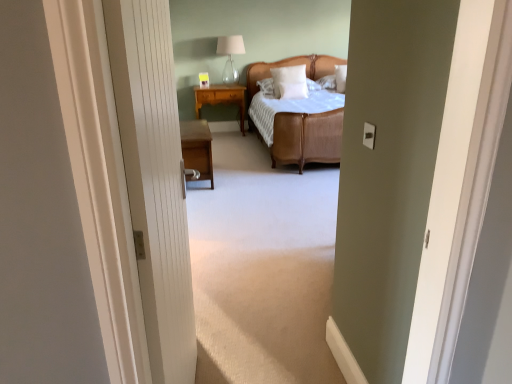
Question: Considering the relative sizes of light brown wood nightstand at center, the 1th nightstand when ordered from top to bottom, and white soft pillow at center, placed as the first pillow when sorted from top to bottom, in the image provided, is light brown wood nightstand at center, the 1th nightstand when ordered from top to bottom, taller than white soft pillow at center, placed as the first pillow when sorted from top to bottom,?

Choices:
 (A) yes
 (B) no

Answer: (A)

Question: Is light brown wood nightstand at center, which is counted as the second nightstand, starting from the bottom, placed right next to white soft pillow at center, which is counted as the second pillow, starting from the bottom?

Choices:
 (A) no
 (B) yes

Answer: (A)

Question: Is light brown wood nightstand at center, which is counted as the second nightstand, starting from the bottom, turned away from white soft pillow at center, which is counted as the second pillow, starting from the bottom?

Choices:
 (A) no
 (B) yes

Answer: (A)

Question: Is light brown wood nightstand at center, the first nightstand when ordered from back to front, oriented towards white soft pillow at center, which is counted as the second pillow, starting from the bottom?

Choices:
 (A) no
 (B) yes

Answer: (A)

Question: Can you confirm if light brown wood nightstand at center, which is counted as the second nightstand, starting from the bottom, is wider than white soft pillow at center, placed as the first pillow when sorted from top to bottom?

Choices:
 (A) no
 (B) yes

Answer: (B)

Question: From a real-world perspective, is woven rattan bed at center above or below white soft pillow at center, placed as the first pillow when sorted from top to bottom?

Choices:
 (A) below
 (B) above

Answer: (A)

Question: From the image's perspective, is woven rattan bed at center positioned above or below white soft pillow at center, placed as the first pillow when sorted from top to bottom?

Choices:
 (A) above
 (B) below

Answer: (B)

Question: Does point (278, 155) appear closer or farther from the camera than point (298, 91)?

Choices:
 (A) closer
 (B) farther

Answer: (A)

Question: Is woven rattan bed at center inside or outside of white soft pillow at center, which is counted as the second pillow, starting from the bottom?

Choices:
 (A) inside
 (B) outside

Answer: (B)

Question: Is point pos(274,72) closer or farther from the camera than point pos(161,135)?

Choices:
 (A) farther
 (B) closer

Answer: (A)

Question: Is white soft pillow at center, which is counted as the second pillow, starting from the bottom, inside or outside of white textured door at center?

Choices:
 (A) inside
 (B) outside

Answer: (B)

Question: In the image, is white soft pillow at center, placed as the first pillow when sorted from top to bottom, on the left side or the right side of white textured door at center?

Choices:
 (A) right
 (B) left

Answer: (A)

Question: From a real-world perspective, is white soft pillow at center, placed as the first pillow when sorted from top to bottom, physically located above or below white textured door at center?

Choices:
 (A) below
 (B) above

Answer: (B)

Question: From the image's perspective, relative to white soft pillow at center, placed as the first pillow when sorted from top to bottom, is wooden nightstand at left, which appears as the second nightstand when viewed from the back, above or below?

Choices:
 (A) above
 (B) below

Answer: (B)

Question: Considering the positions of wooden nightstand at left, which is counted as the first nightstand, starting from the bottom, and white soft pillow at center, placed as the first pillow when sorted from top to bottom, in the image, is wooden nightstand at left, which is counted as the first nightstand, starting from the bottom, bigger or smaller than white soft pillow at center, placed as the first pillow when sorted from top to bottom,?

Choices:
 (A) big
 (B) small

Answer: (A)